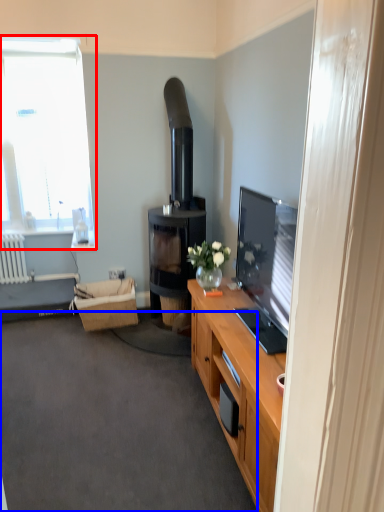
Question: Which of the following is the closest to the observer, window (highlighted by a red box) or plain (highlighted by a blue box)?

Choices:
 (A) window
 (B) plain

Answer: (B)